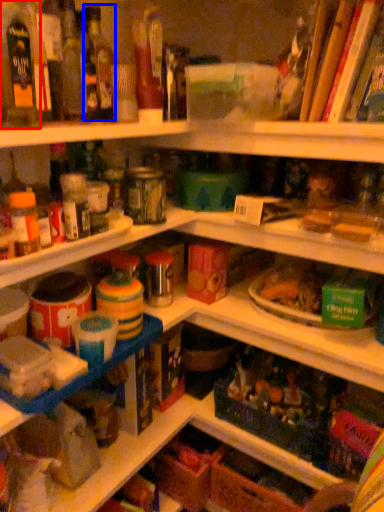
Question: Which object appears farthest to the camera in this image, bottle (highlighted by a red box) or bottle (highlighted by a blue box)?

Choices:
 (A) bottle
 (B) bottle

Answer: (B)